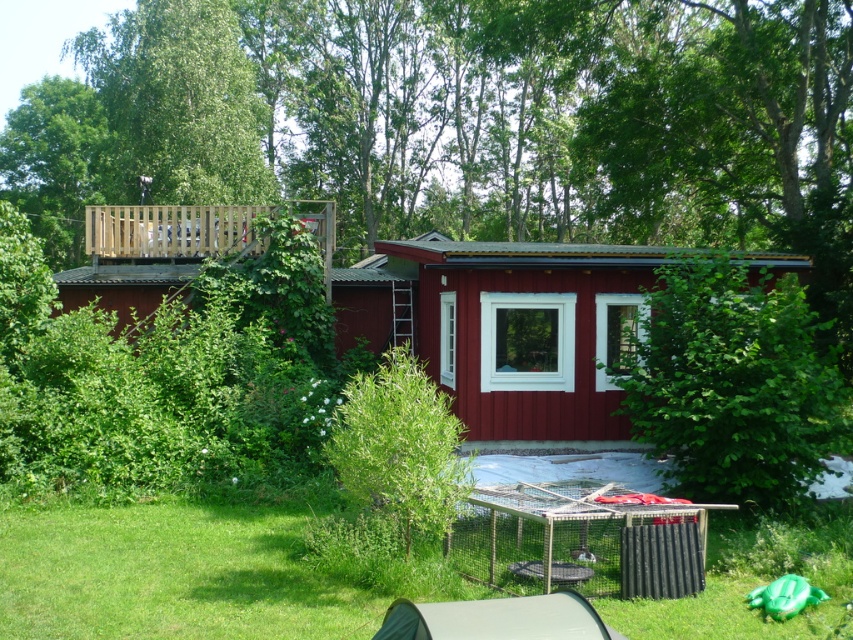
You are setting up a picnic and want to place a blanket on the green grass at lower center. However, there is a gray fabric tent at lower center in the way. Can you place the blanket directly under the tent? Explain your reasoning using the scene description.

The green grass at lower center is located below the gray fabric tent at lower center, so yes, you can place the blanket directly under the tent since the grass is positioned underneath it.

You are planning to set up a picnic area near the smooth wooden cabin at center and the gray fabric tent at lower center. Which object should you place your picnic blanket closer to if you want it to be at a lower elevation?

The gray fabric tent at lower center is at a lower elevation than the smooth wooden cabin at center, so you should place your picnic blanket closer to the gray fabric tent at lower center.